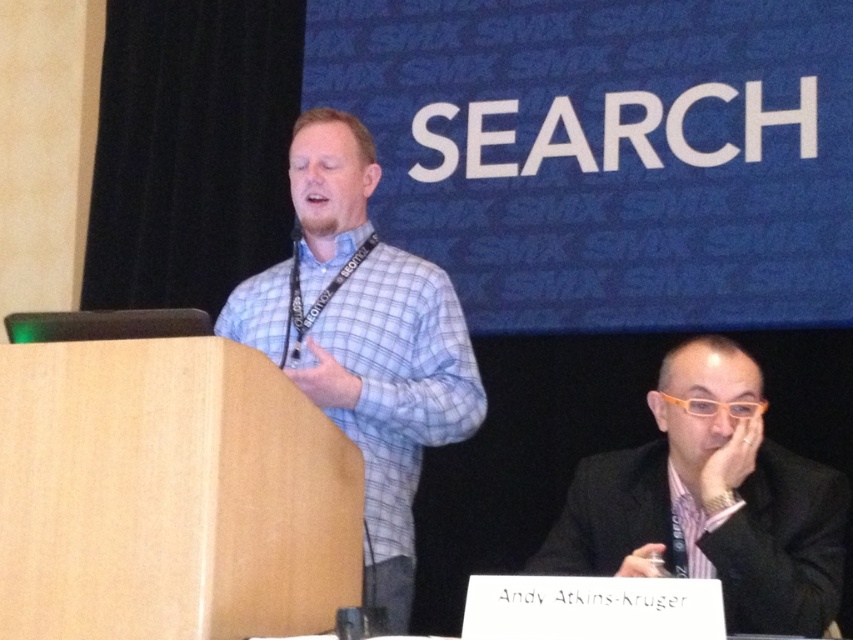
Question: Does blue checkered shirt at center appear under black suit at lower right?

Choices:
 (A) no
 (B) yes

Answer: (A)

Question: Does blue checkered shirt at center have a lesser width compared to black suit at lower right?

Choices:
 (A) no
 (B) yes

Answer: (A)

Question: From the image, what is the correct spatial relationship of blue checkered shirt at center in relation to black suit at lower right?

Choices:
 (A) below
 (B) above

Answer: (B)

Question: Which object is farther from the camera taking this photo?

Choices:
 (A) black suit at lower right
 (B) blue checkered shirt at center

Answer: (B)